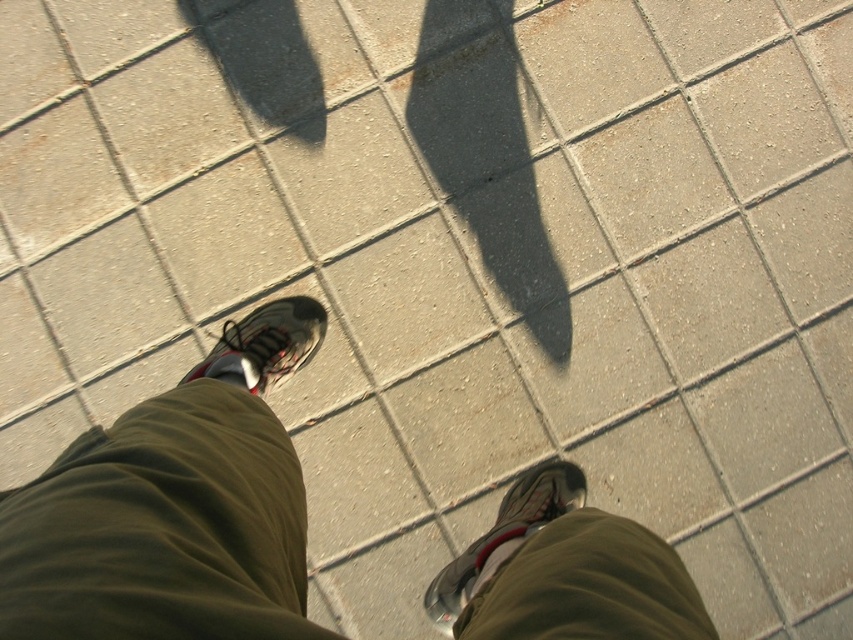
You are a photographer trying to capture the reflection of the shiny metallic shoe at lower center and the matte black shoe at center on the pavement. Since the pavement is made of light gray square tiles with visible grout lines, which shoe do you think will have a clearer reflection?

The shiny metallic shoe at lower center will have a clearer reflection because it is positioned closer to the light source, which is above, and its reflective surface can cast a better image on the pavement compared to the matte black shoe at center.

You are a photographer standing at a certain distance from the khaki cotton pants at center. If you want to take a closeup shot of the pants, should you move closer or farther away?

The khaki cotton pants at center are 57.89 centimeters away from the camera. To take a closeup shot, you should move closer to the khaki cotton pants at center.